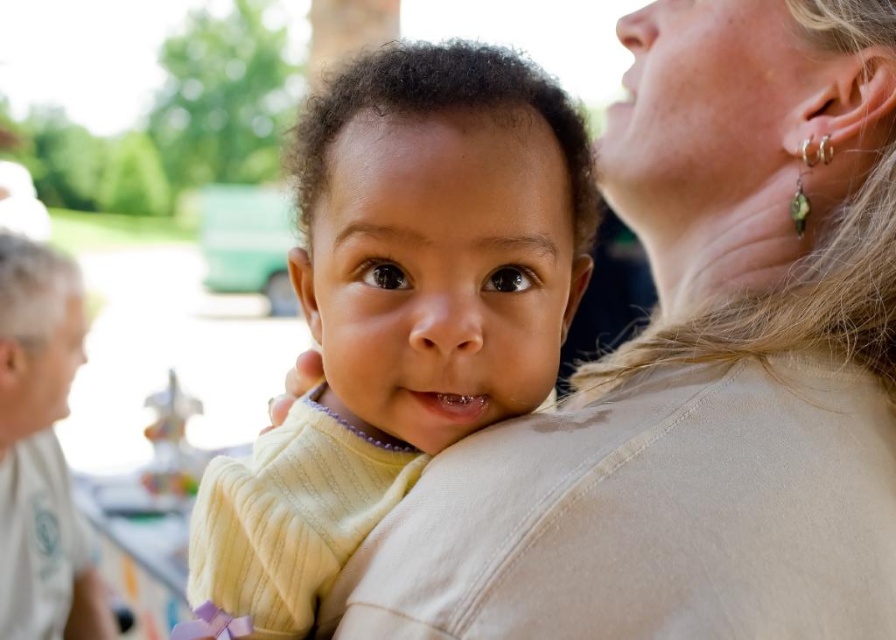
Does smooth beige sweater at upper right have a lesser width compared to soft yellow sweater at center?

In fact, smooth beige sweater at upper right might be wider than soft yellow sweater at center.

Who is more distant from viewer, [860,148] or [233,536]?

Positioned behind is point [860,148].

Where is `smooth beige sweater at upper right`? smooth beige sweater at upper right is located at coordinates (696, 371).

Where is `smooth beige sweater at upper right`? The width and height of the screenshot is (896, 640). smooth beige sweater at upper right is located at coordinates (696, 371).